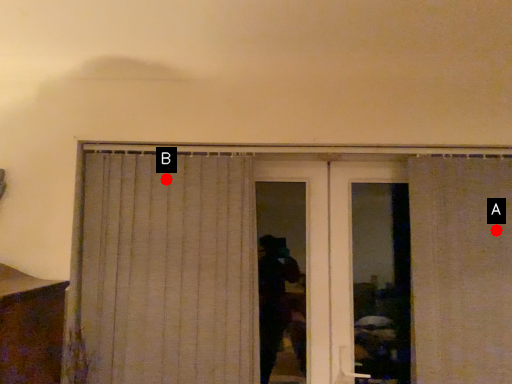
Question: Two points are circled on the image, labeled by A and B beside each circle. Which point is farther from the camera taking this photo?

Choices:
 (A) A is further
 (B) B is further

Answer: (B)